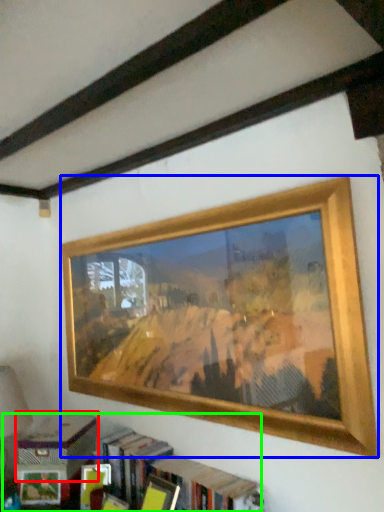
Question: Estimate the real-world distances between objects in this image. Which object is closer to paperback book (highlighted by a red box), picture frame (highlighted by a blue box) or bookcase (highlighted by a green box)?

Choices:
 (A) picture frame
 (B) bookcase

Answer: (B)